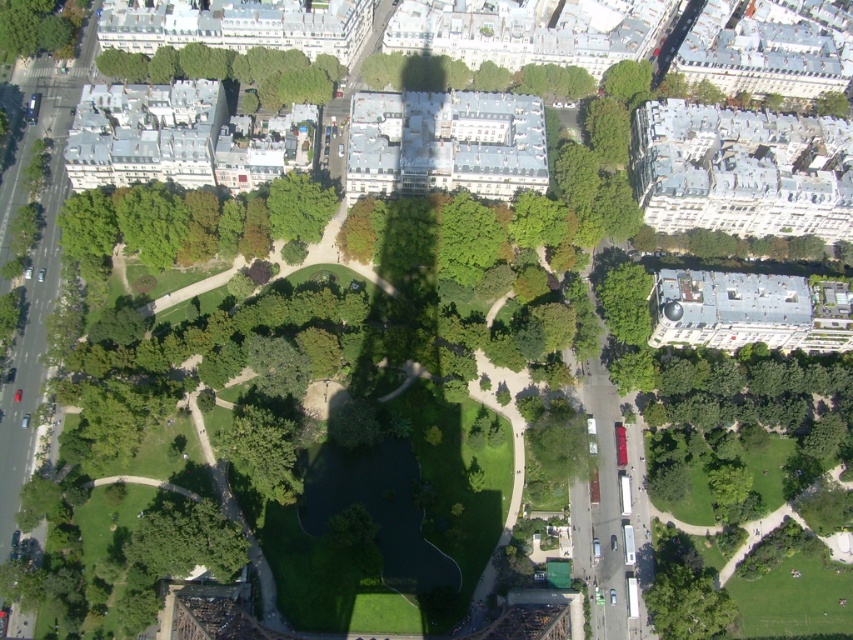
From the picture: Is green leafy trees at upper left to the left of green leafy tree at upper left from the viewer's perspective?

Incorrect, green leafy trees at upper left is not on the left side of green leafy tree at upper left.

Between green leafy trees at upper left and green leafy tree at upper left, which one has more height?

Standing taller between the two is green leafy tree at upper left.

This screenshot has width=853, height=640. Identify the location of green leafy trees at upper left. (231, 70).

Is green leafy trees at center smaller than green leafy trees at upper left?

Incorrect, green leafy trees at center is not smaller in size than green leafy trees at upper left.

Is green leafy trees at center thinner than green leafy trees at upper left?

Yes, green leafy trees at center is thinner than green leafy trees at upper left.

Is point (161, 220) behind point (239, 74)?

No, (161, 220) is in front of (239, 74).

Locate an element on the screen. Image resolution: width=853 pixels, height=640 pixels. green leafy trees at center is located at coordinates (128, 224).

Image resolution: width=853 pixels, height=640 pixels. What do you see at coordinates (128, 224) in the screenshot?
I see `green leafy trees at center` at bounding box center [128, 224].

Locate an element on the screen. green leafy trees at center is located at coordinates (128, 224).